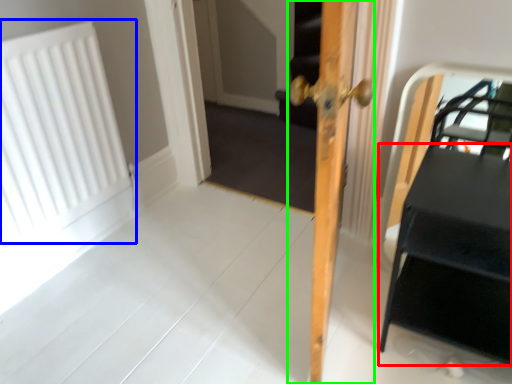
Question: Estimate the real-world distances between objects in this image. Which object is closer to table (highlighted by a red box), radiator (highlighted by a blue box) or door (highlighted by a green box)?

Choices:
 (A) radiator
 (B) door

Answer: (B)